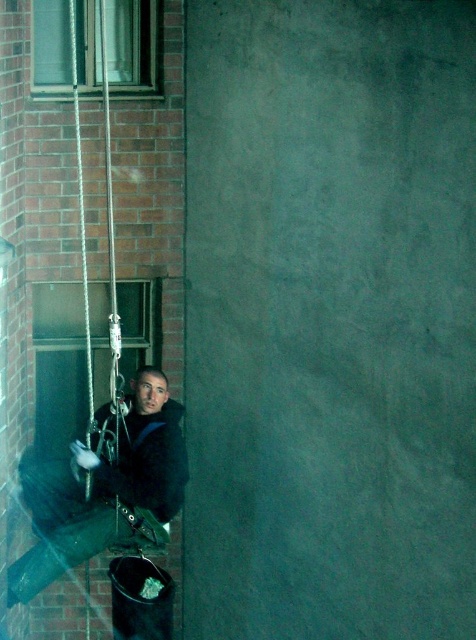
Is dark gray fabric jacket at left closer to camera compared to clear glass window at upper left?

Yes.

Is dark gray fabric jacket at left behind clear glass window at upper left?

No, dark gray fabric jacket at left is in front of clear glass window at upper left.

Which is in front, point (41, 497) or point (95, 12)?

Positioned in front is point (95, 12).

Locate an element on the screen. The image size is (476, 640). dark gray fabric jacket at left is located at coordinates (105, 490).

Can you confirm if dark gray fabric jacket at left is smaller than clear glass window at center?

No, dark gray fabric jacket at left is not smaller than clear glass window at center.

Does dark gray fabric jacket at left appear on the left side of clear glass window at center?

Incorrect, dark gray fabric jacket at left is not on the left side of clear glass window at center.

Identify the location of dark gray fabric jacket at left. The width and height of the screenshot is (476, 640). (105, 490).

You are a GUI agent. You are given a task and a screenshot of the screen. Output one action in this format:
    pyautogui.click(x=<x>, y=<y>)
    Task: Click on the dark gray fabric jacket at left
    
    Given the screenshot: What is the action you would take?
    pyautogui.click(x=105, y=490)

Can you confirm if clear glass window at center is positioned to the right of clear glass window at upper left?

No, clear glass window at center is not to the right of clear glass window at upper left.

Is the position of clear glass window at center more distant than that of clear glass window at upper left?

Yes, it is.

Is point (146, 353) in front of point (40, 74)?

No, it is not.

Image resolution: width=476 pixels, height=640 pixels. I want to click on clear glass window at center, so click(x=59, y=364).